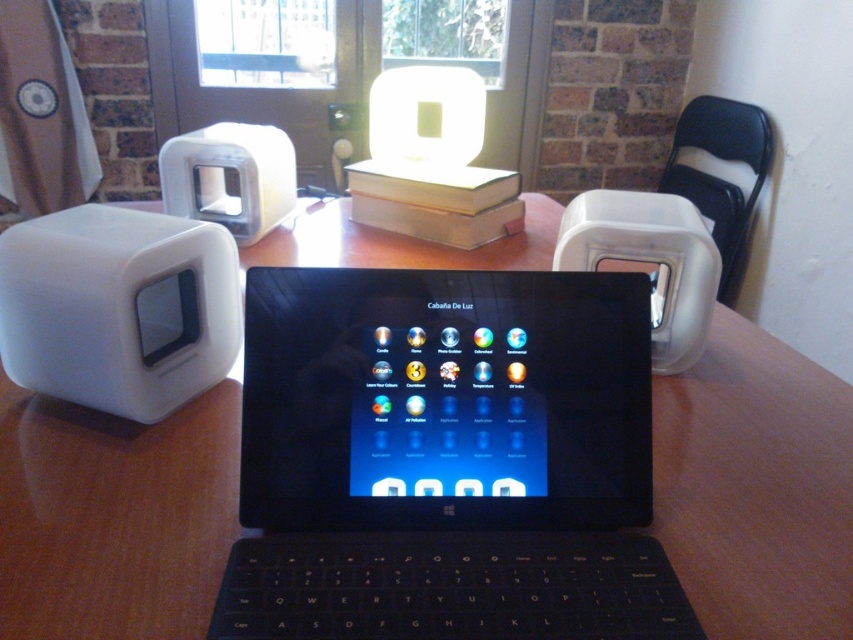
Question: Which of the following is the farthest from the observer?

Choices:
 (A) wooden table at center
 (B) white matte toaster at right

Answer: (A)

Question: Can you confirm if wooden table at center is thinner than white matte toaster at right?

Choices:
 (A) yes
 (B) no

Answer: (B)

Question: Is black plastic laptop at center to the left of white matte toaster at upper left from the viewer's perspective?

Choices:
 (A) no
 (B) yes

Answer: (A)

Question: Which object appears closest to the camera in this image?

Choices:
 (A) black plastic laptop at center
 (B) white plastic toaster at left
 (C) white matte toaster at upper left
 (D) white matte toaster at right

Answer: (A)

Question: Based on their relative distances, which object is nearer to the black plastic laptop at center?

Choices:
 (A) wooden table at center
 (B) white matte toaster at upper left
 (C) white matte toaster at right
 (D) white plastic toaster at left

Answer: (C)

Question: Can you confirm if white plastic toaster at left is wider than white matte toaster at upper left?

Choices:
 (A) yes
 (B) no

Answer: (A)